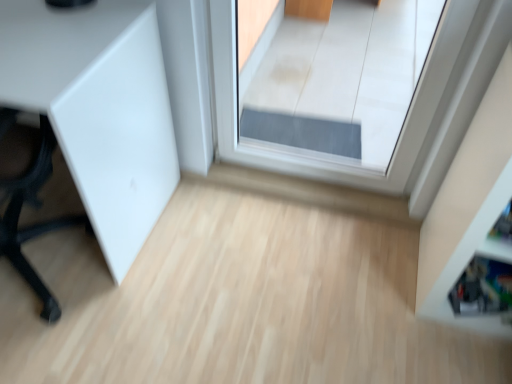
Question: Is white matte cabinet at left wider or thinner than white glossy shelf at right?

Choices:
 (A) thin
 (B) wide

Answer: (B)

Question: Visually, is white matte cabinet at left positioned to the left or to the right of white glossy shelf at right?

Choices:
 (A) right
 (B) left

Answer: (B)

Question: Which object is the closest to the transparent glass door at center?

Choices:
 (A) white glossy shelf at right
 (B) white matte cabinet at left

Answer: (B)

Question: Which is farther from the white glossy shelf at right?

Choices:
 (A) white matte cabinet at left
 (B) transparent glass door at center

Answer: (B)